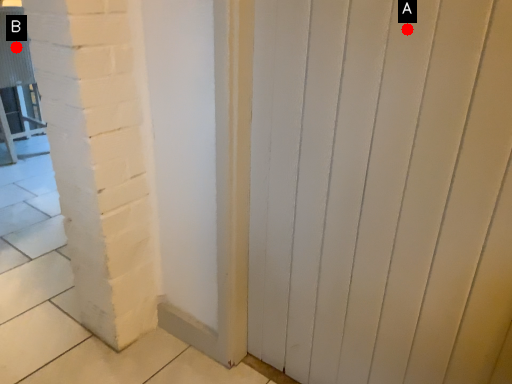
Question: Two points are circled on the image, labeled by A and B beside each circle. Among these points, which one is farthest from the camera?

Choices:
 (A) A is further
 (B) B is further

Answer: (B)